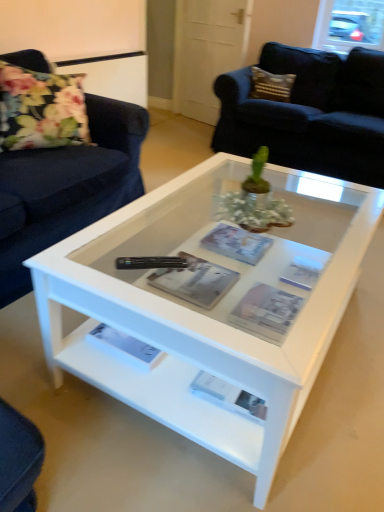
Question: Can you confirm if black plastic remote at center is wider than white glossy coffee table at center?

Choices:
 (A) no
 (B) yes

Answer: (A)

Question: Would you say black plastic remote at center is outside white glossy coffee table at center?

Choices:
 (A) yes
 (B) no

Answer: (A)

Question: Is black plastic remote at center taller than white glossy coffee table at center?

Choices:
 (A) yes
 (B) no

Answer: (B)

Question: Does black plastic remote at center have a smaller size compared to white glossy coffee table at center?

Choices:
 (A) no
 (B) yes

Answer: (B)

Question: Is black plastic remote at center facing away from white glossy coffee table at center?

Choices:
 (A) no
 (B) yes

Answer: (A)

Question: Is black plastic remote at center with white glossy coffee table at center?

Choices:
 (A) no
 (B) yes

Answer: (A)

Question: Considering the relative sizes of matte gray magazine at center, marked as the first magazine in a front-to-back arrangement, and matte gray magazine at center, which appears as the third magazine when viewed from the front, in the image provided, is matte gray magazine at center, marked as the first magazine in a front-to-back arrangement, thinner than matte gray magazine at center, which appears as the third magazine when viewed from the front,?

Choices:
 (A) yes
 (B) no

Answer: (B)

Question: Is matte gray magazine at center, which appears as the 3th magazine when viewed from the back, not near matte gray magazine at center, which appears as the first magazine when viewed from the back?

Choices:
 (A) yes
 (B) no

Answer: (B)

Question: From the image's perspective, is matte gray magazine at center, marked as the first magazine in a front-to-back arrangement, located beneath matte gray magazine at center, which appears as the first magazine when viewed from the back?

Choices:
 (A) no
 (B) yes

Answer: (B)

Question: Is matte gray magazine at center, which appears as the 3th magazine when viewed from the back, closer to the viewer compared to matte gray magazine at center, which appears as the first magazine when viewed from the back?

Choices:
 (A) yes
 (B) no

Answer: (A)

Question: Is matte gray magazine at center, marked as the first magazine in a front-to-back arrangement, looking in the opposite direction of matte gray magazine at center, which appears as the third magazine when viewed from the front?

Choices:
 (A) no
 (B) yes

Answer: (A)

Question: From the image's perspective, is matte gray magazine at center, marked as the first magazine in a front-to-back arrangement, on top of matte gray magazine at center, which appears as the first magazine when viewed from the back?

Choices:
 (A) no
 (B) yes

Answer: (A)

Question: From a real-world perspective, is matte gray magazine at center, marked as the first magazine in a front-to-back arrangement, on floral fabric pillow at left?

Choices:
 (A) yes
 (B) no

Answer: (B)